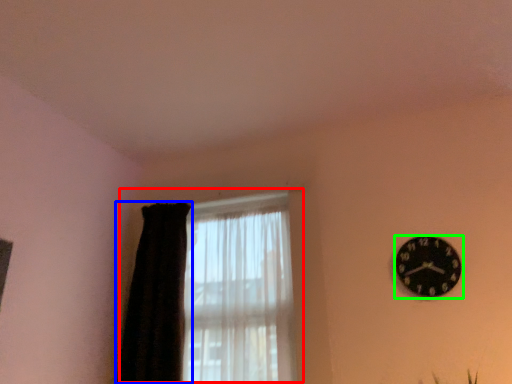
Question: Based on their relative distances, which object is farther from window (highlighted by a red box)? Choose from curtain (highlighted by a blue box) and wall clock (highlighted by a green box).

Choices:
 (A) curtain
 (B) wall clock

Answer: (B)